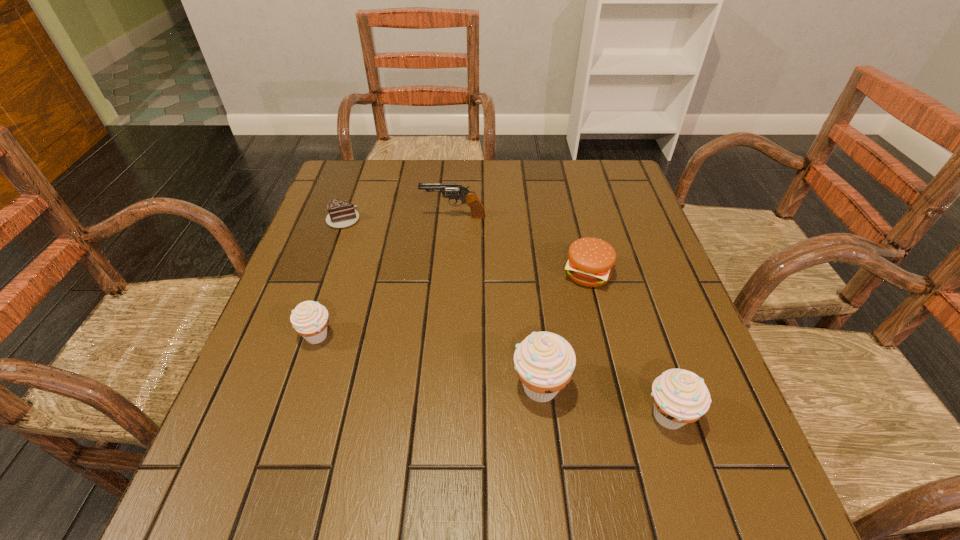
Find the location of a particular element. hamburger that is at the right edge is located at coordinates (590, 261).

This screenshot has width=960, height=540. I want to click on object that is at the near right corner, so click(680, 396).

Where is `vacant space at the far edge of the desktop`? vacant space at the far edge of the desktop is located at coordinates (404, 163).

The width and height of the screenshot is (960, 540). In the image, there is a desktop. Find the location of `vacant space at the left edge`. vacant space at the left edge is located at coordinates (354, 272).

Locate an element on the screen. The width and height of the screenshot is (960, 540). free region at the right edge of the desktop is located at coordinates [591, 223].

In the image, there is a desktop. Where is `vacant area at the far right corner`? vacant area at the far right corner is located at coordinates (590, 160).

The height and width of the screenshot is (540, 960). Identify the location of vacant space that's between the second muffin from right to left and the fourth object from right to left. (496, 302).

I want to click on free spot between the chocolate cake and the rightmost muffin, so click(x=506, y=317).

I want to click on empty space between the leftmost muffin and the second shortest object, so click(x=452, y=305).

Where is `free spot between the gun and the third farthest object`? This screenshot has height=540, width=960. free spot between the gun and the third farthest object is located at coordinates (520, 245).